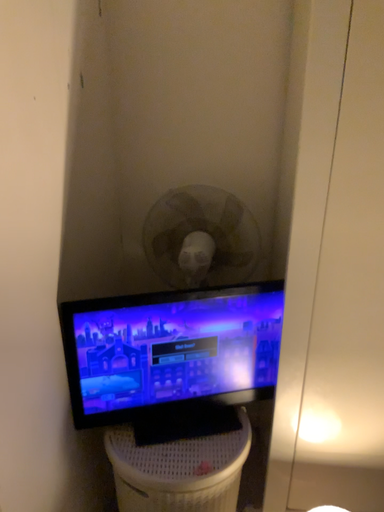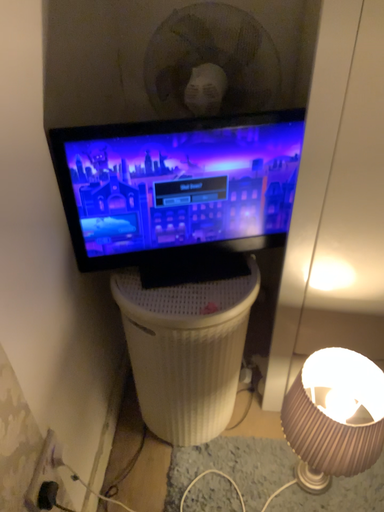
Question: Which way did the camera rotate in the video?

Choices:
 (A) rotated downward
 (B) rotated upward

Answer: (A)